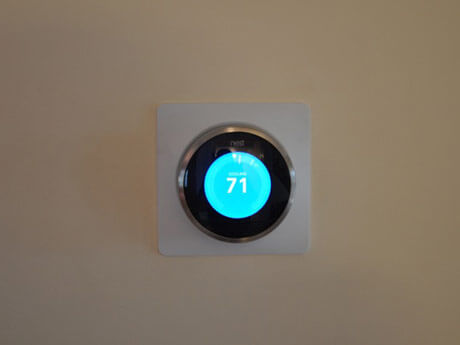
Where is `wall`? wall is located at coordinates (80, 185).